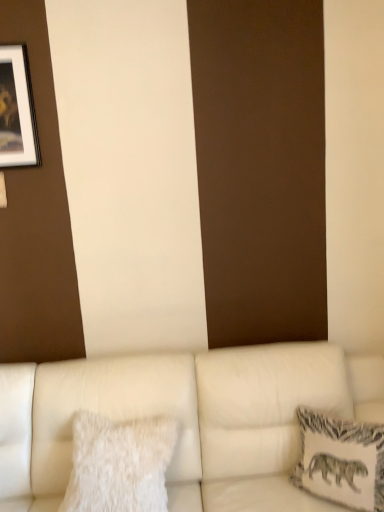
Question: Does white fluffy pillow at lower left, the 1th pillow positioned from the left, have a larger size compared to matte black picture frame at upper left?

Choices:
 (A) yes
 (B) no

Answer: (A)

Question: Is white fluffy pillow at lower left, the 1th pillow positioned from the left, shorter than matte black picture frame at upper left?

Choices:
 (A) yes
 (B) no

Answer: (A)

Question: Is there a large distance between white fluffy pillow at lower left, acting as the second pillow starting from the right, and matte black picture frame at upper left?

Choices:
 (A) yes
 (B) no

Answer: (A)

Question: Is white fluffy pillow at lower left, acting as the second pillow starting from the right, smaller than matte black picture frame at upper left?

Choices:
 (A) no
 (B) yes

Answer: (A)

Question: Is white fluffy pillow at lower left, the 1th pillow positioned from the left, located outside matte black picture frame at upper left?

Choices:
 (A) yes
 (B) no

Answer: (A)

Question: Is white textured pillow at right, acting as the first pillow starting from the right, in front of or behind white fluffy pillow at lower left, the 1th pillow positioned from the left, in the image?

Choices:
 (A) front
 (B) behind

Answer: (A)

Question: In terms of width, does white textured pillow at right, arranged as the second pillow when viewed from the left, look wider or thinner when compared to white fluffy pillow at lower left, acting as the second pillow starting from the right?

Choices:
 (A) wide
 (B) thin

Answer: (B)

Question: Considering the positions of white textured pillow at right, arranged as the second pillow when viewed from the left, and white fluffy pillow at lower left, the 1th pillow positioned from the left, in the image, is white textured pillow at right, arranged as the second pillow when viewed from the left, bigger or smaller than white fluffy pillow at lower left, the 1th pillow positioned from the left,?

Choices:
 (A) small
 (B) big

Answer: (A)

Question: Choose the correct answer: Is white textured pillow at right, arranged as the second pillow when viewed from the left, inside white fluffy pillow at lower left, acting as the second pillow starting from the right, or outside it?

Choices:
 (A) inside
 (B) outside

Answer: (B)

Question: Is matte black picture frame at upper left to the left or to the right of white leather couch at lower center in the image?

Choices:
 (A) left
 (B) right

Answer: (A)

Question: Is point (3, 162) positioned closer to the camera than point (354, 392)?

Choices:
 (A) farther
 (B) closer

Answer: (B)

Question: Is matte black picture frame at upper left in front of or behind white leather couch at lower center in the image?

Choices:
 (A) behind
 (B) front

Answer: (A)

Question: From a real-world perspective, is matte black picture frame at upper left above or below white leather couch at lower center?

Choices:
 (A) above
 (B) below

Answer: (A)

Question: In terms of width, does white leather couch at lower center look wider or thinner when compared to matte black picture frame at upper left?

Choices:
 (A) thin
 (B) wide

Answer: (B)

Question: Is white leather couch at lower center in front of or behind matte black picture frame at upper left in the image?

Choices:
 (A) front
 (B) behind

Answer: (A)